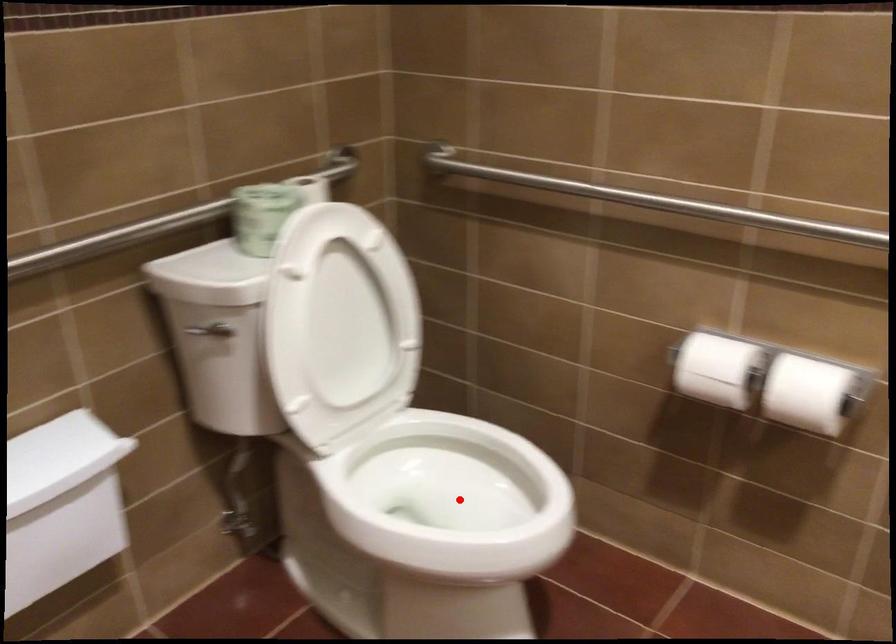
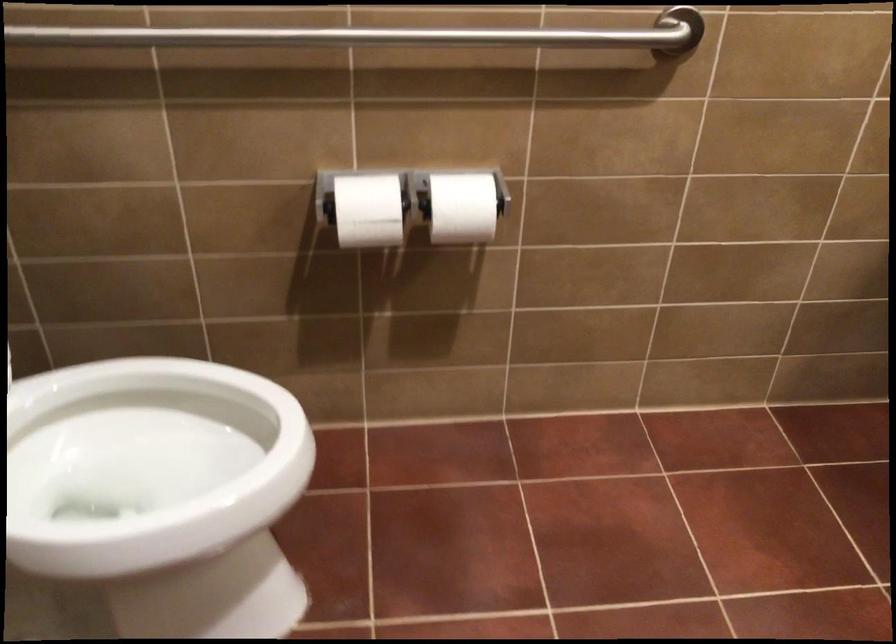
Question: A red point is marked in image1. In image2, is the corresponding 3D point closer to the camera or farther? Reply with the corresponding letter.

Choices:
 (A) The corresponding 3D point is closer.
 (B) The corresponding 3D point is farther.

Answer: (A)